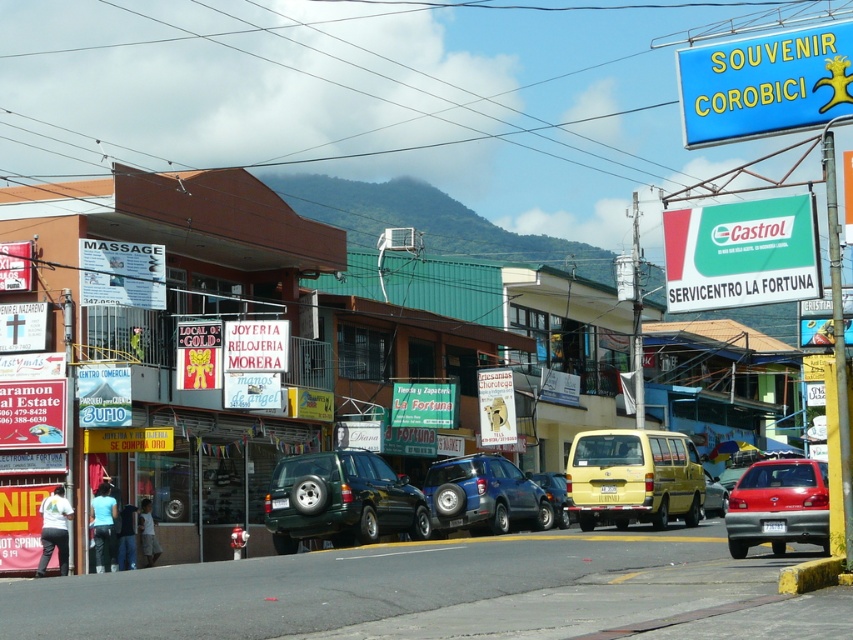
You are a delivery driver who needs to park your truck between the green matte suv at center and the metallic silver suv at center. Given that your truck is 6 meters long, can you fit it in the space between them?

The green matte suv at center is larger than the metallic silver suv at center, but the distance between them isn

You are standing at the point with coordinates point (412, 157) and want to walk to the point point (680, 493). Given the street layout, will you have to go around any parked vehicles along the way?

Point (412, 157) is behind point (680, 493), so you will not have to go around any parked vehicles along the way.

You are a delivery person who needs to load a large package onto one of the two SUVs at the center of the image. Which SUV, the green matte suv at center or the metallic silver suv at center, would be more suitable for the task based on their size?

The green matte suv at center is much taller than the metallic silver suv at center, making it more suitable for loading a large package due to its greater height.